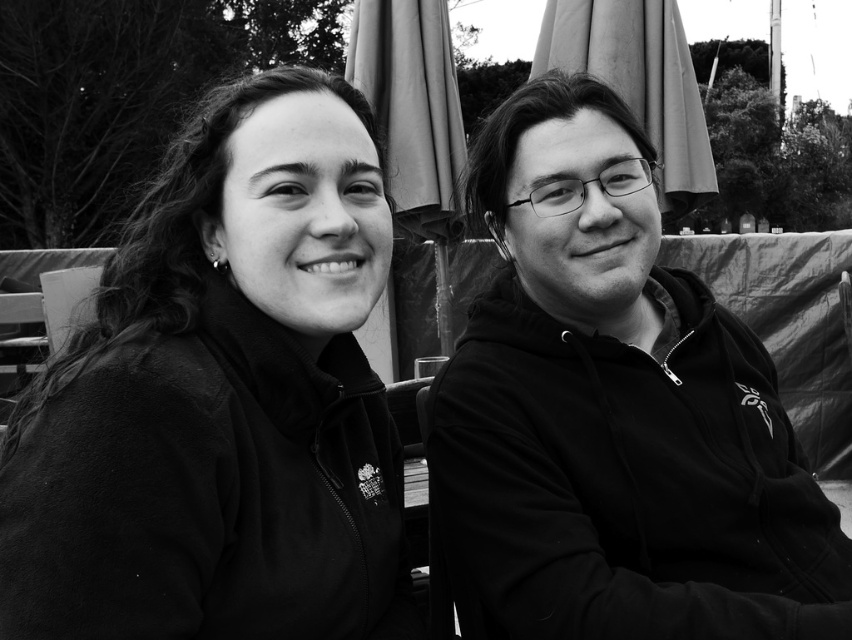
You are taking a photo of two people sitting on chairs under a tarp in the image. You want to focus on the person closer to the camera. Which coordinate point should you adjust your camera focus to? The options are point (108, 561) or point (532, 163)?

Point (108, 561) is closer to the camera than point (532, 163), so you should focus on point (108, 561).

You are standing in front of the photograph and want to place a small sticker exactly at the center of the matte black jacket at left. According to the coordinates provided, what are the coordinates where you should place the sticker?

The coordinates for the center of the matte black jacket at left are given as point (x=217, y=413).